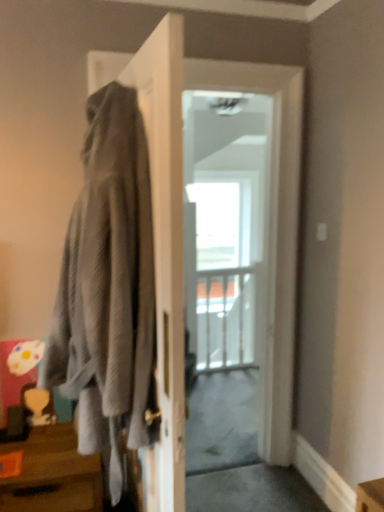
Question: Does white glossy door at center come in front of brown wood table at lower left?

Choices:
 (A) no
 (B) yes

Answer: (A)

Question: From a real-world perspective, is white glossy door at center physically below brown wood table at lower left?

Choices:
 (A) yes
 (B) no

Answer: (B)

Question: Can you confirm if white glossy door at center is bigger than brown wood table at lower left?

Choices:
 (A) no
 (B) yes

Answer: (B)

Question: Are white glossy door at center and brown wood table at lower left making contact?

Choices:
 (A) yes
 (B) no

Answer: (B)

Question: Is white glossy door at center further to the viewer compared to brown wood table at lower left?

Choices:
 (A) yes
 (B) no

Answer: (A)

Question: Does white glossy door at center have a smaller size compared to brown wood table at lower left?

Choices:
 (A) no
 (B) yes

Answer: (A)

Question: From a real-world perspective, is gray textured hoodie at left under white glossy door at center?

Choices:
 (A) yes
 (B) no

Answer: (B)

Question: Is gray textured hoodie at left oriented towards white glossy door at center?

Choices:
 (A) yes
 (B) no

Answer: (B)

Question: Is gray textured hoodie at left beside white glossy door at center?

Choices:
 (A) yes
 (B) no

Answer: (B)

Question: Is gray textured hoodie at left positioned beyond the bounds of white glossy door at center?

Choices:
 (A) no
 (B) yes

Answer: (B)

Question: Is gray textured hoodie at left to the right of white glossy door at center from the viewer's perspective?

Choices:
 (A) yes
 (B) no

Answer: (B)

Question: Is gray textured hoodie at left bigger than white glossy door at center?

Choices:
 (A) no
 (B) yes

Answer: (B)

Question: Can you confirm if brown wood table at lower left is positioned to the right of gray textured hoodie at left?

Choices:
 (A) no
 (B) yes

Answer: (A)